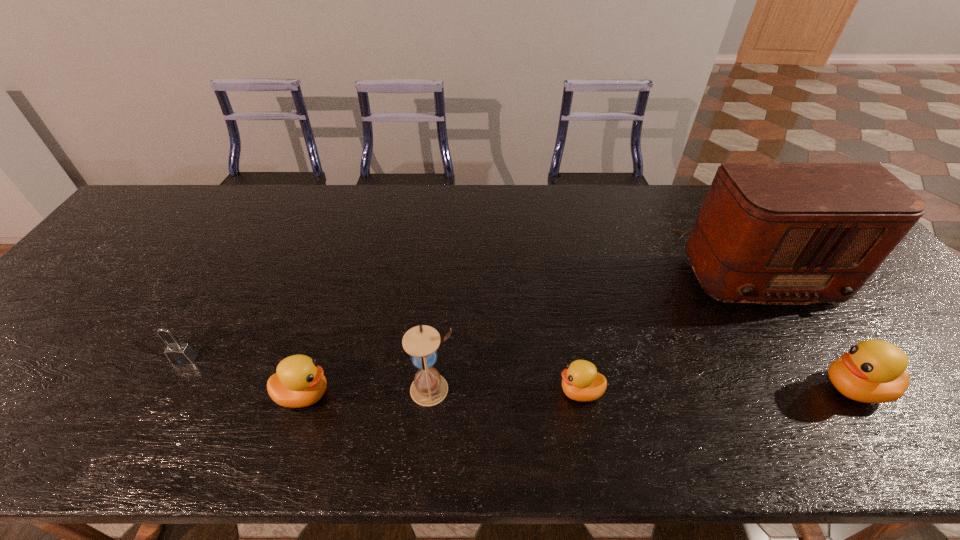
This screenshot has width=960, height=540. Identify the location of blank region between the fourth object from right to left and the rightmost duckling. point(643,389).

This screenshot has width=960, height=540. I want to click on empty location between the padlock and the third tallest object, so click(519, 374).

Locate an element on the screen. The height and width of the screenshot is (540, 960). vacant area between the hourglass and the radio receiver is located at coordinates click(594, 328).

In order to click on free space between the tallest duckling and the padlock in this screenshot , I will do `click(519, 374)`.

Identify the location of the fifth closest object to the rightmost duckling. (178, 353).

Identify which object is the fifth closest to the second object from left to right. Please provide its 2D coordinates. Your answer should be formatted as a tuple, i.e. [(x, y)], where the tuple contains the x and y coordinates of a point satisfying the conditions above.

[(873, 371)]

The height and width of the screenshot is (540, 960). Find the location of `duckling object that ranks as the third closest to the padlock`. duckling object that ranks as the third closest to the padlock is located at coordinates (873, 371).

What are the coordinates of `the second closest duckling to the second shortest duckling` in the screenshot? It's located at (873, 371).

I want to click on free spot that satisfies the following two spatial constraints: 1. on the front panel of the farthest object; 2. on the face of the shortest object, so click(x=834, y=392).

At what (x,y) coordinates should I click in order to perform the action: click on vacant position in the image that satisfies the following two spatial constraints: 1. on the front panel of the farthest object; 2. on the face of the shortest duckling. Please return your answer as a coordinate pair (x, y). This screenshot has width=960, height=540. Looking at the image, I should click on (834, 392).